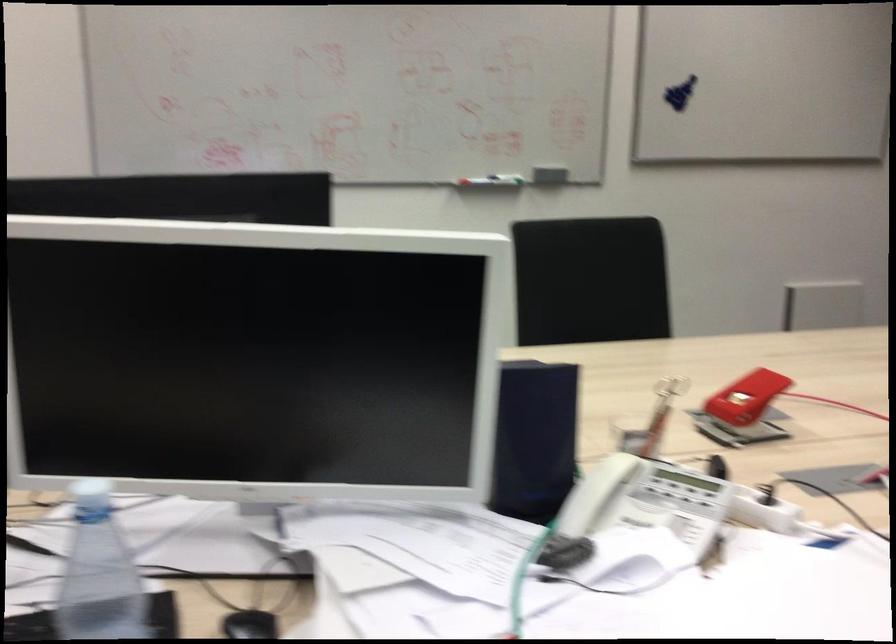
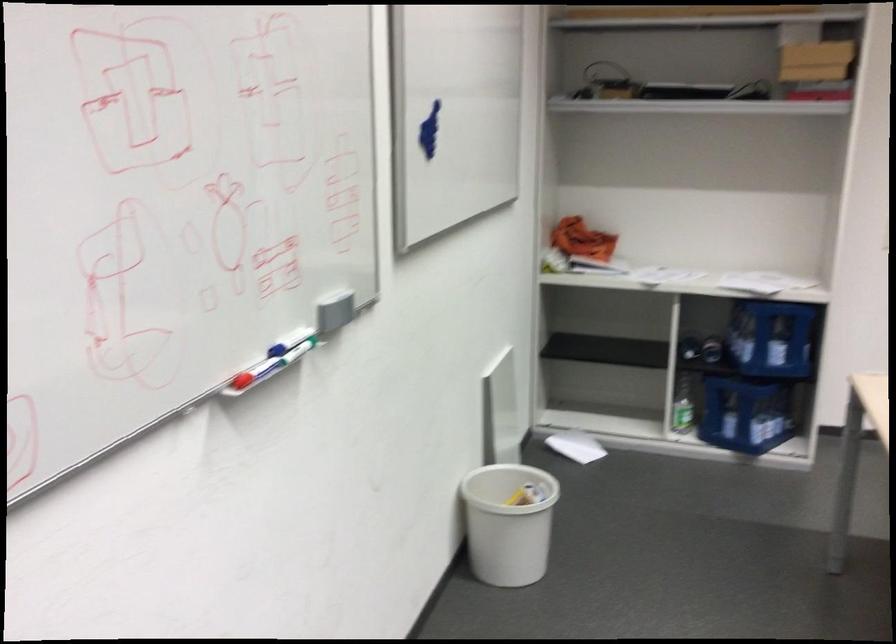
Locate, in the second image, the point that corresponds to pixel 533 172 in the first image.

(293, 355)